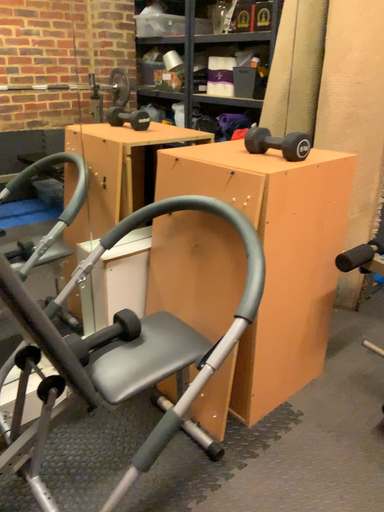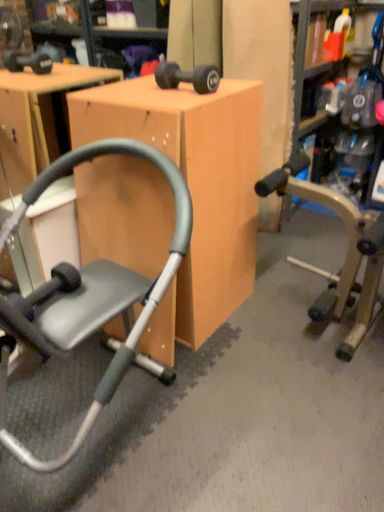
Question: Which way did the camera rotate in the video?

Choices:
 (A) rotated downward
 (B) rotated upward

Answer: (A)